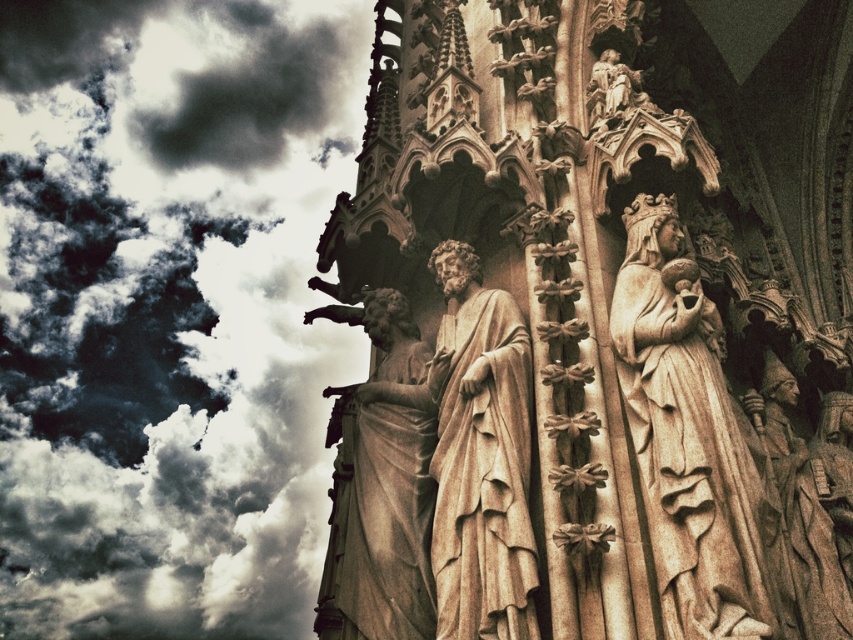
You are an architect analyzing the Gothic cathedral structure. You notice the dark gray cloud at upper left in the scene. Based on its position, can you determine if it is positioned to the left or right of the central axis of the cathedral?

The dark gray cloud at upper left is located at point (169, 310), which places it to the left of the central axis of the cathedral.

In the scene shown: You are an architect examining the Gothic cathedral structure. You notice the dark gray cloud at upper left and the beige stone statue at right. Which object is located higher in the scene?

The dark gray cloud at upper left is positioned over the beige stone statue at right, meaning it is higher up in the scene.